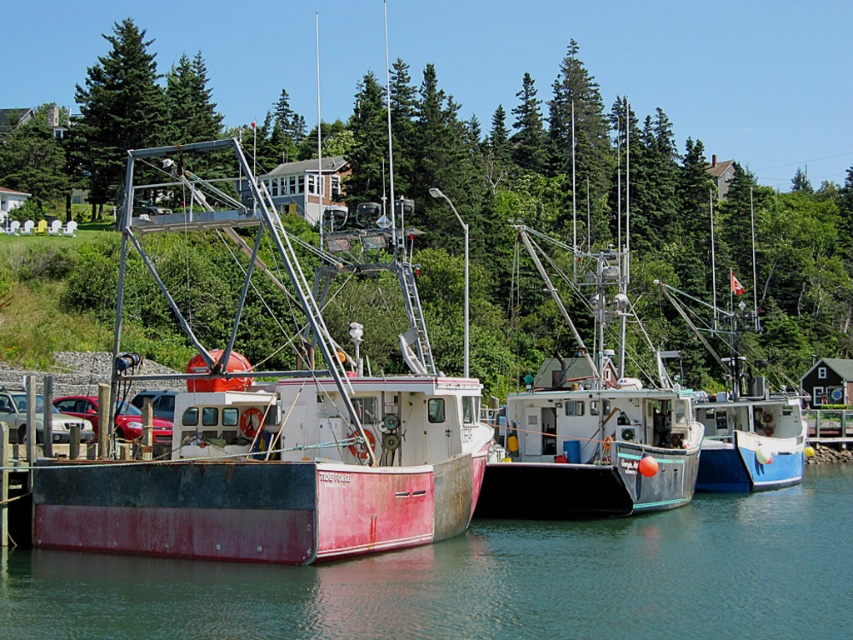
Question: Is smooth water at center positioned in front of green leafy tree at upper left?

Choices:
 (A) no
 (B) yes

Answer: (B)

Question: Is green leafy tree at center positioned before rusty metal boat at center?

Choices:
 (A) yes
 (B) no

Answer: (B)

Question: Which of the following is the farthest from the observer?

Choices:
 (A) teal matte boat at center
 (B) smooth water at center
 (C) green leafy tree at center

Answer: (A)

Question: Which of these objects is positioned closest to the green leafy tree at upper left?

Choices:
 (A) smooth water at center
 (B) teal matte boat at center
 (C) rusty metal boat at center

Answer: (B)

Question: Observing the image, what is the correct spatial positioning of rusty metal boat at center in reference to teal matte boat at center?

Choices:
 (A) right
 (B) left

Answer: (B)

Question: Which of the following is the farthest from the observer?

Choices:
 (A) smooth water at center
 (B) rusty metal boat at center

Answer: (B)